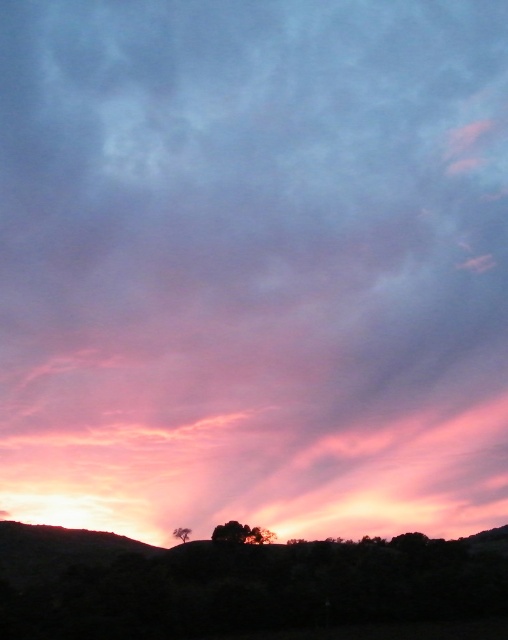
You are an artist sketching the sunset scene. You notice the dark brown textured hillside at lower center and the silhouetted tree at lower center. Which object is positioned lower in the image?

The dark brown textured hillside at lower center is located below the silhouetted tree at lower center, so it is positioned lower in the image.